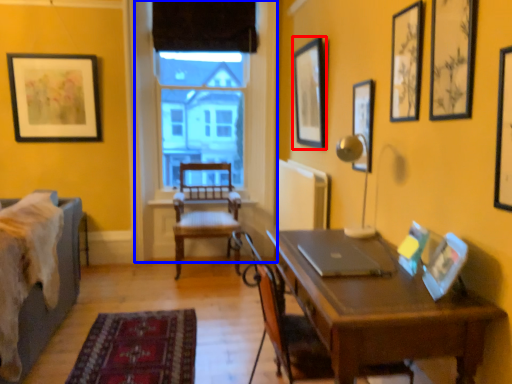
Question: Which object is further to the camera taking this photo, picture frame (highlighted by a red box) or window frame (highlighted by a blue box)?

Choices:
 (A) picture frame
 (B) window frame

Answer: (B)